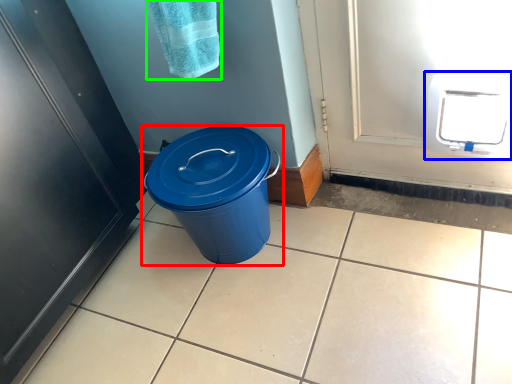
Question: Considering the real-world distances, which object is closest to waste container (highlighted by a red box)? appliance (highlighted by a blue box) or bath towel (highlighted by a green box).

Choices:
 (A) appliance
 (B) bath towel

Answer: (B)